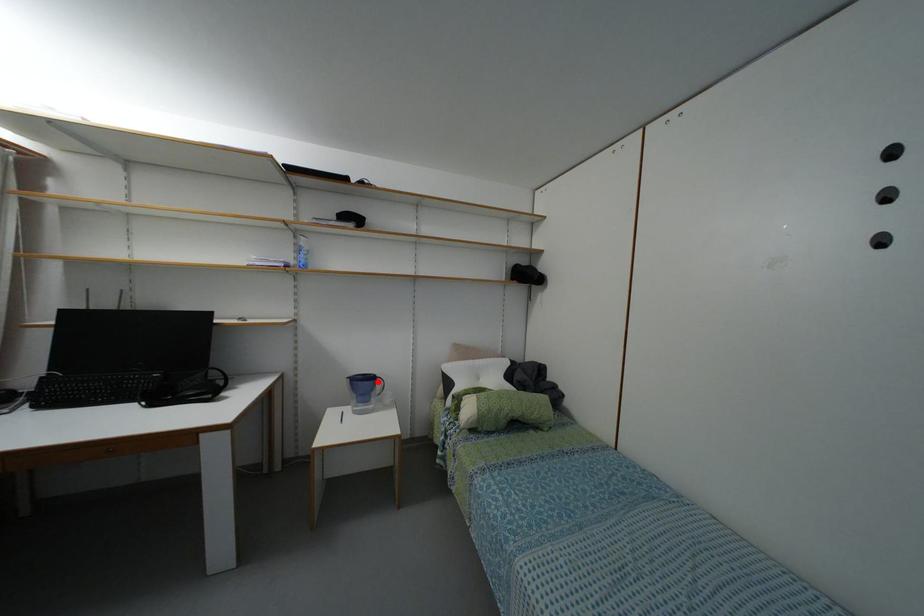
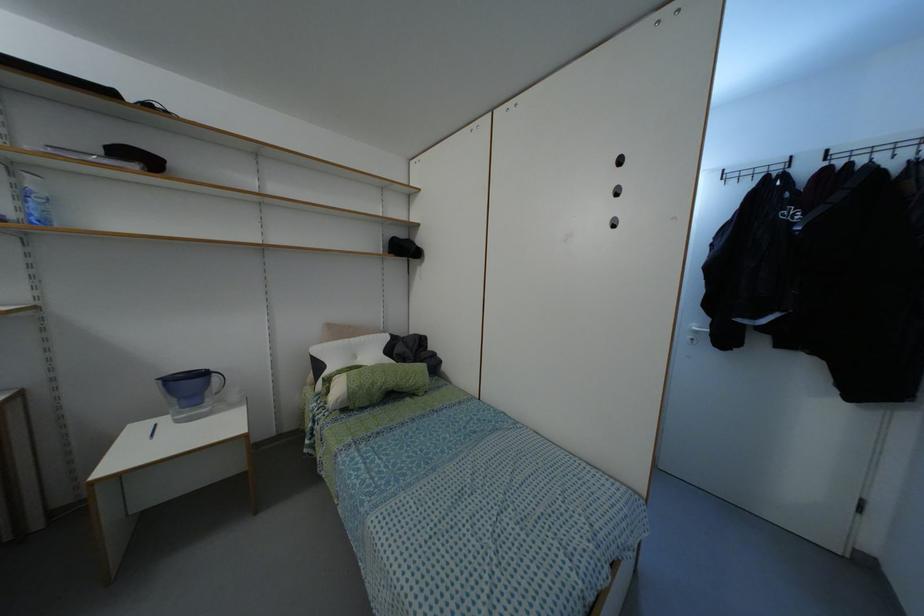
Where in the second image is the point corresponding to the highlighted location from the first image?

(214, 378)